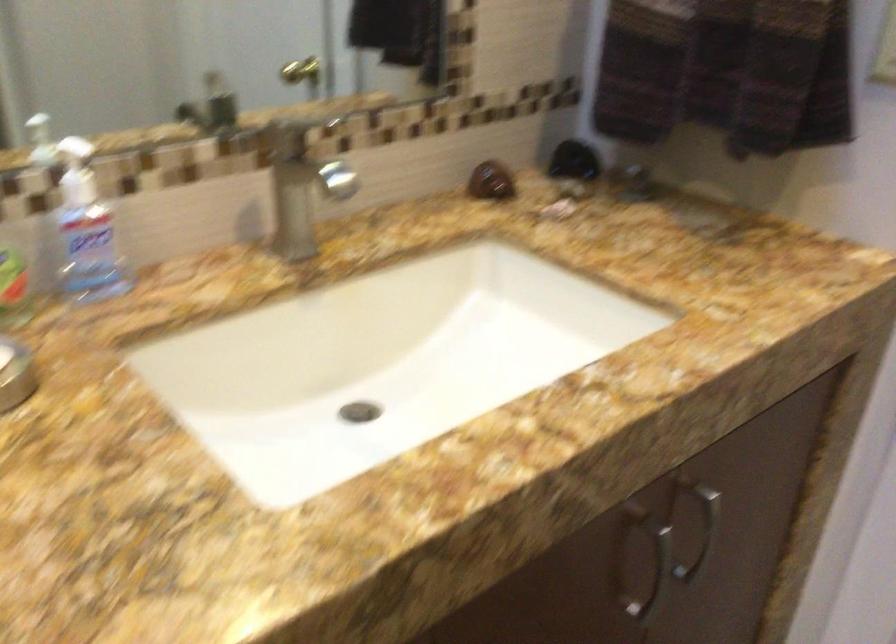
What do you see at coordinates (76, 172) in the screenshot? I see `the soap dispenser pump` at bounding box center [76, 172].